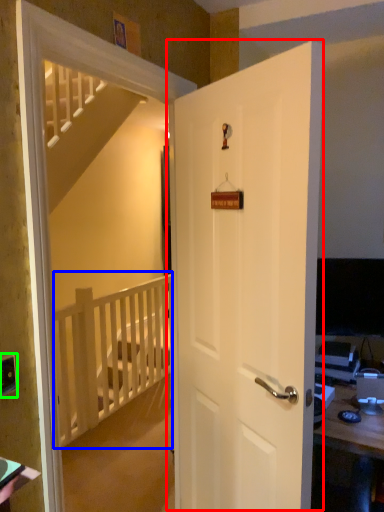
Question: Which is nearer to the door (highlighted by a red box)? balustrade (highlighted by a blue box) or electric outlet (highlighted by a green box).

Choices:
 (A) balustrade
 (B) electric outlet

Answer: (B)